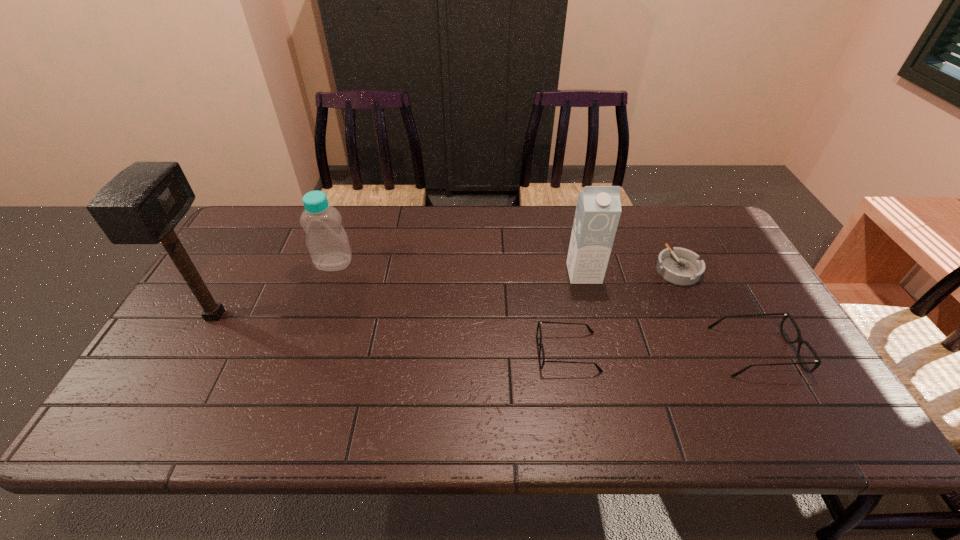
Locate an element on the screen. object that is at the near right corner is located at coordinates (799, 339).

This screenshot has height=540, width=960. In the image, there is a desktop. In order to click on free space at the far edge in this screenshot , I will do `click(538, 227)`.

The height and width of the screenshot is (540, 960). Identify the location of vacant area at the near edge of the desktop. coord(468,394).

Where is `free space at the left edge of the desktop`? free space at the left edge of the desktop is located at coordinates (260, 256).

In the image, there is a desktop. Where is `blank space at the right edge`? blank space at the right edge is located at coordinates (754, 350).

You are a GUI agent. You are given a task and a screenshot of the screen. Output one action in this format:
    pyautogui.click(x=<x>, y=<y>)
    Task: Click on the vacant area at the far left corner
    The height and width of the screenshot is (540, 960).
    Given the screenshot: What is the action you would take?
    pyautogui.click(x=266, y=236)

This screenshot has height=540, width=960. Find the location of `vacant region between the bottle and the shortest object`. vacant region between the bottle and the shortest object is located at coordinates (506, 266).

Identify the location of vacant area that lies between the mallet and the taller spectacles. (486, 333).

The width and height of the screenshot is (960, 540). What are the coordinates of `vacant space that's between the ashtray and the carton` in the screenshot? It's located at (631, 271).

Image resolution: width=960 pixels, height=540 pixels. I want to click on free point between the fifth shortest object and the left spectacles, so click(576, 313).